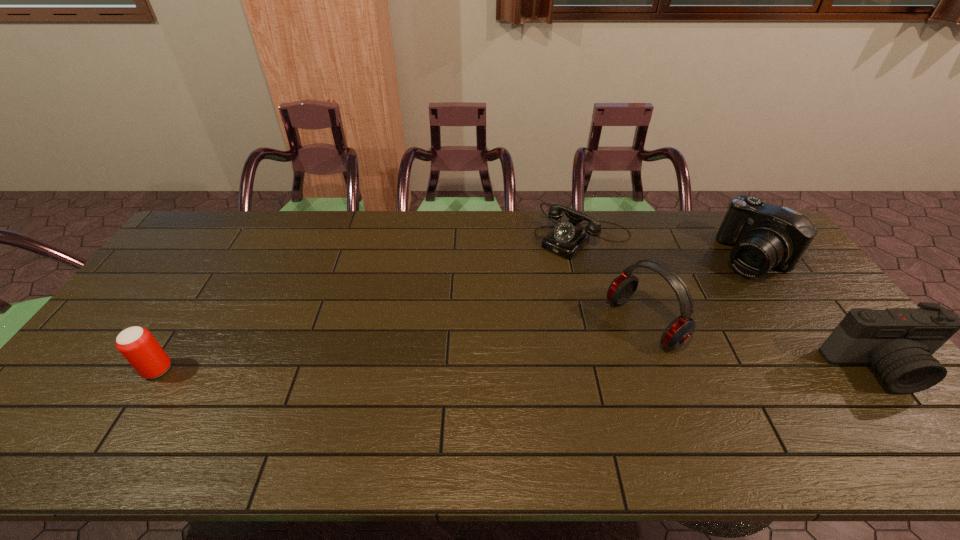
At what (x,y) coordinates should I click in order to perform the action: click on vacant area that lies between the farther camera and the telephone. Please return your answer as a coordinate pair (x, y). This screenshot has height=540, width=960. Looking at the image, I should click on (667, 248).

Find the location of a particular element. The width and height of the screenshot is (960, 540). empty space that is in between the farther camera and the nearer camera is located at coordinates (816, 313).

Where is `blank region between the leftmost object and the earphone`? blank region between the leftmost object and the earphone is located at coordinates (401, 346).

The image size is (960, 540). I want to click on unoccupied area between the telephone and the second shortest object, so click(x=371, y=303).

Where is `empty space between the telephone and the nearer camera`? This screenshot has height=540, width=960. empty space between the telephone and the nearer camera is located at coordinates (732, 303).

Locate an element on the screen. the fourth closest object relative to the farther camera is located at coordinates (138, 346).

Locate which object ranks second in proximity to the shortest object. Please provide its 2D coordinates. Your answer should be formatted as a tuple, i.e. [(x, y)], where the tuple contains the x and y coordinates of a point satisfying the conditions above.

[(765, 236)]

Find the location of a particular element. Image resolution: width=960 pixels, height=540 pixels. vacant space that satisfies the following two spatial constraints: 1. on the back side of the earphone; 2. on the right side of the farther camera is located at coordinates (621, 258).

You are a GUI agent. You are given a task and a screenshot of the screen. Output one action in this format:
    pyautogui.click(x=<x>, y=<y>)
    Task: Click on the vacant space that satisfies the following two spatial constraints: 1. on the front side of the shortest object; 2. on the left side of the farther camera
    Image resolution: width=960 pixels, height=540 pixels.
    Given the screenshot: What is the action you would take?
    pyautogui.click(x=588, y=258)